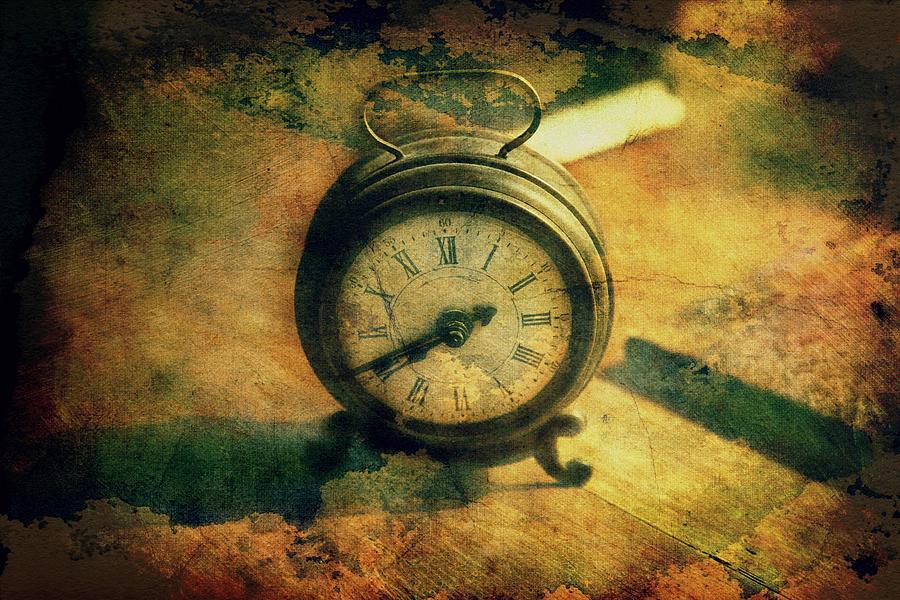
Where is `handle on top center of alarm clock`? This screenshot has height=600, width=900. handle on top center of alarm clock is located at coordinates (379, 138), (426, 79), (536, 122).